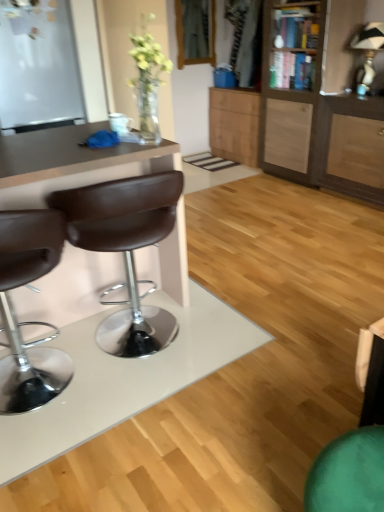
Identify the location of unoccupied region to the right of brown leather desk at left. (241, 306).